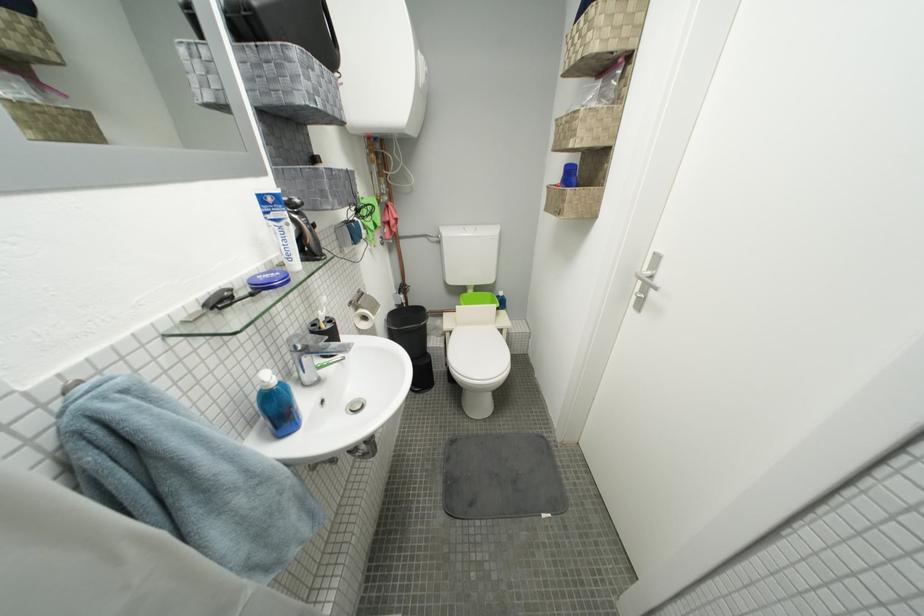
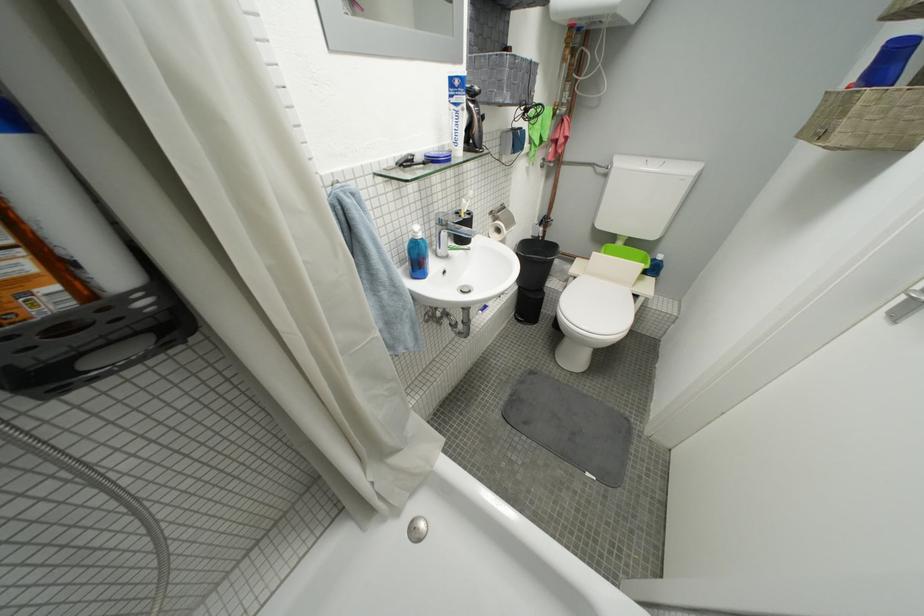
Where in the second image is the point corresponding to [479,236] from the first image?

(662, 169)